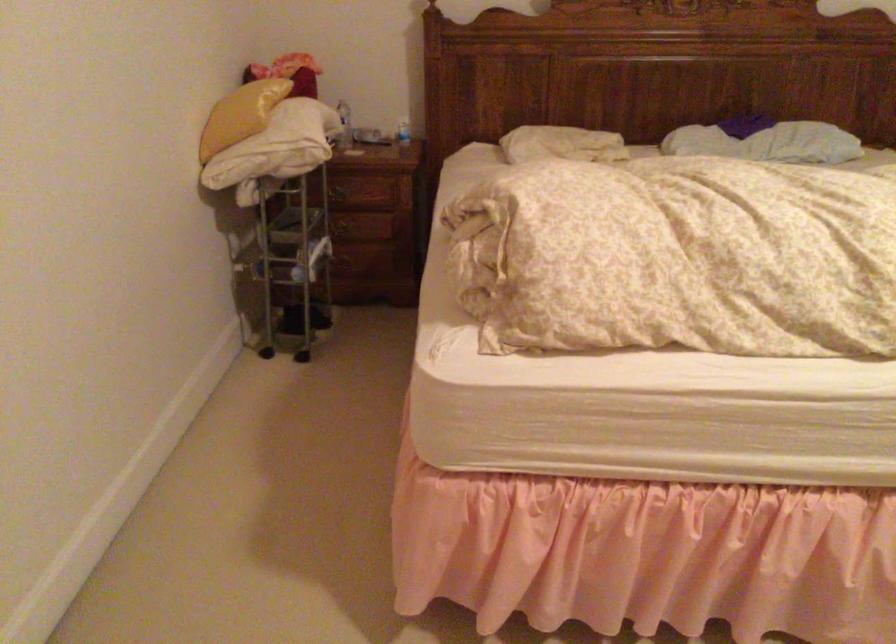
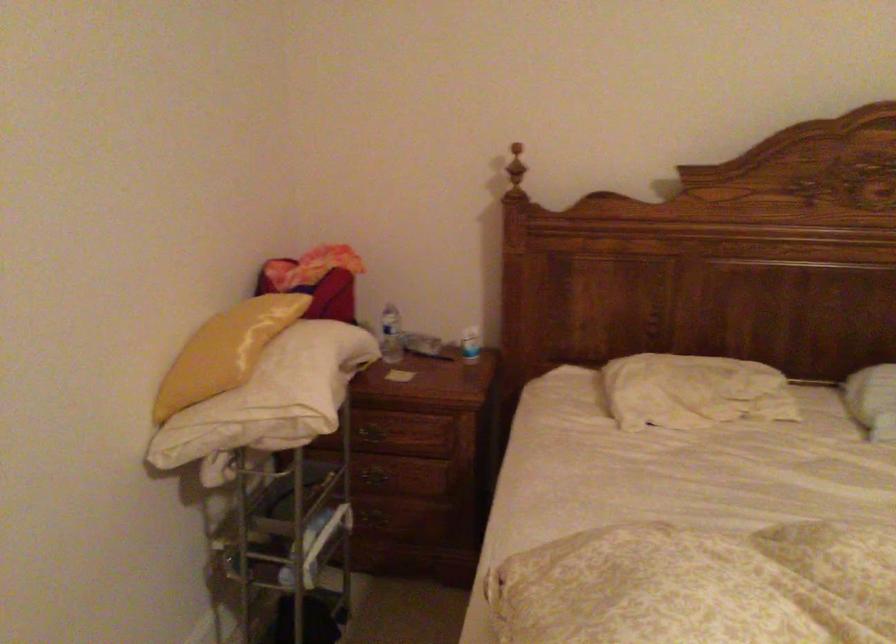
In the second image, find the point that corresponds to point 251,107 in the first image.

(225, 351)